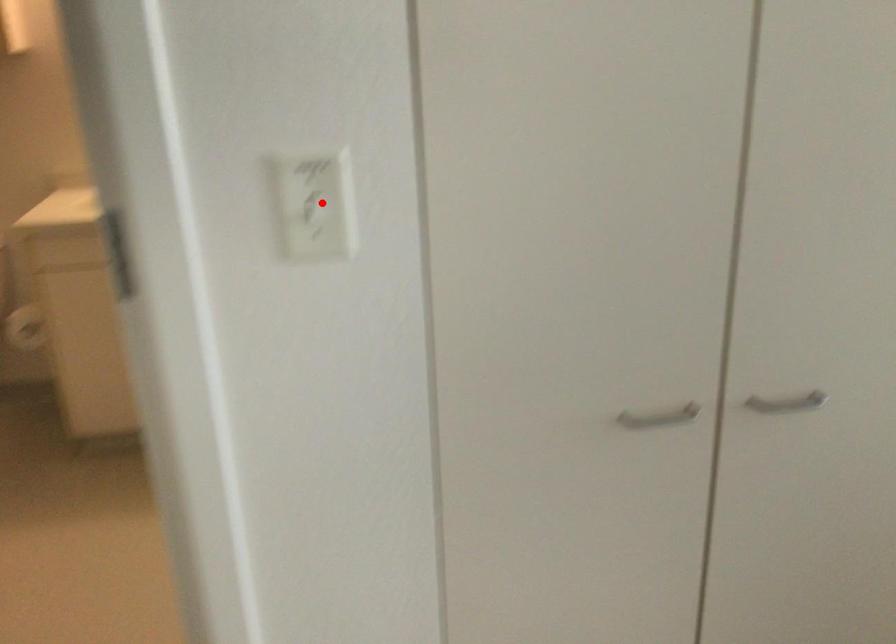
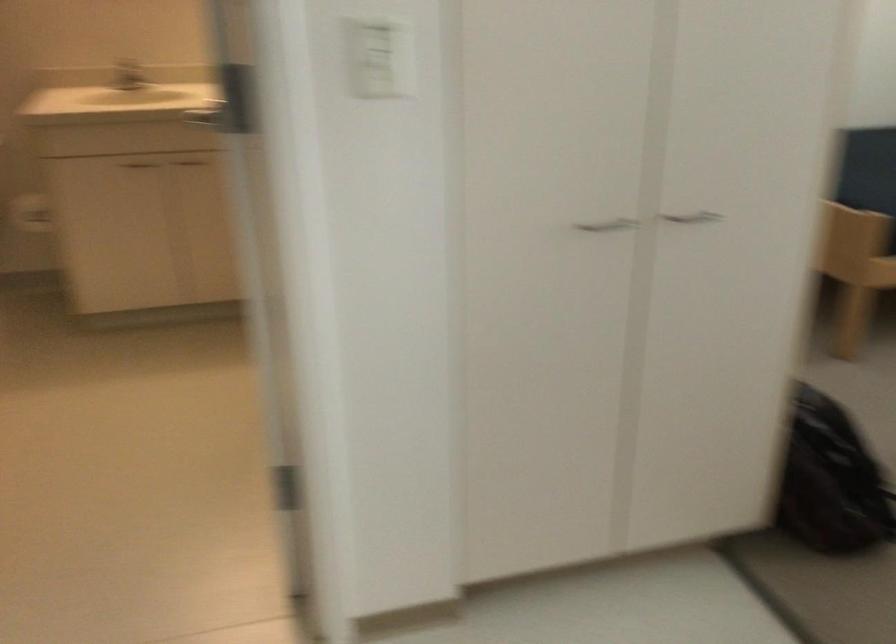
Where in the second image is the point corresponding to the highlighted location from the first image?

(381, 59)